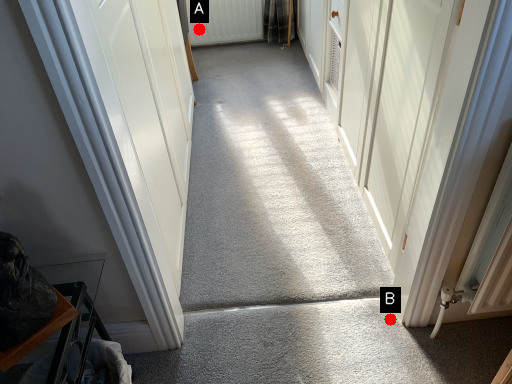
Question: Two points are circled on the image, labeled by A and B beside each circle. Which point is further to the camera?

Choices:
 (A) A is further
 (B) B is further

Answer: (A)